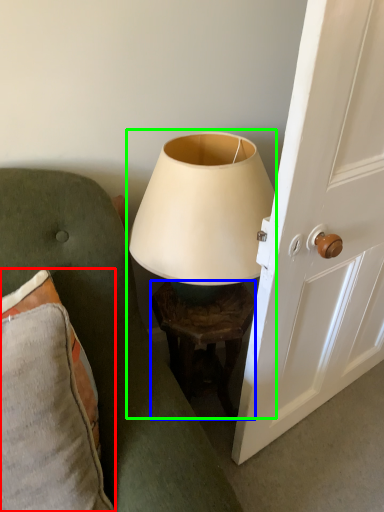
Question: Which object is the closest to the pillow (highlighted by a red box)? Choose among these: table (highlighted by a blue box) or lamp (highlighted by a green box).

Choices:
 (A) table
 (B) lamp

Answer: (B)